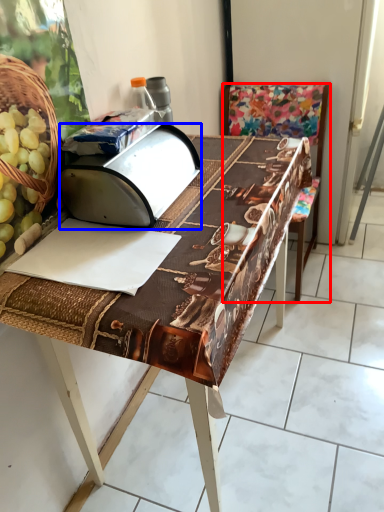
Question: Which object is closer to the camera taking this photo, chair (highlighted by a red box) or wide (highlighted by a blue box)?

Choices:
 (A) chair
 (B) wide

Answer: (B)